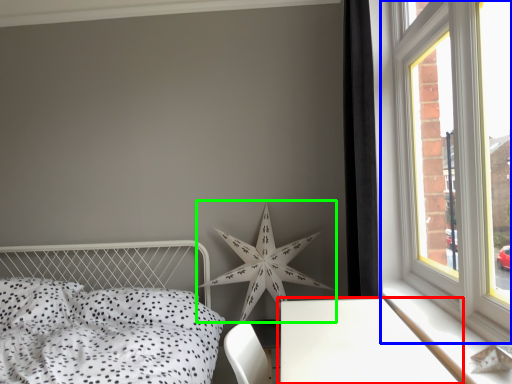
Question: Based on their relative distances, which object is nearer to table (highlighted by a red box)? Choose from window (highlighted by a blue box) and star (highlighted by a green box).

Choices:
 (A) window
 (B) star

Answer: (A)